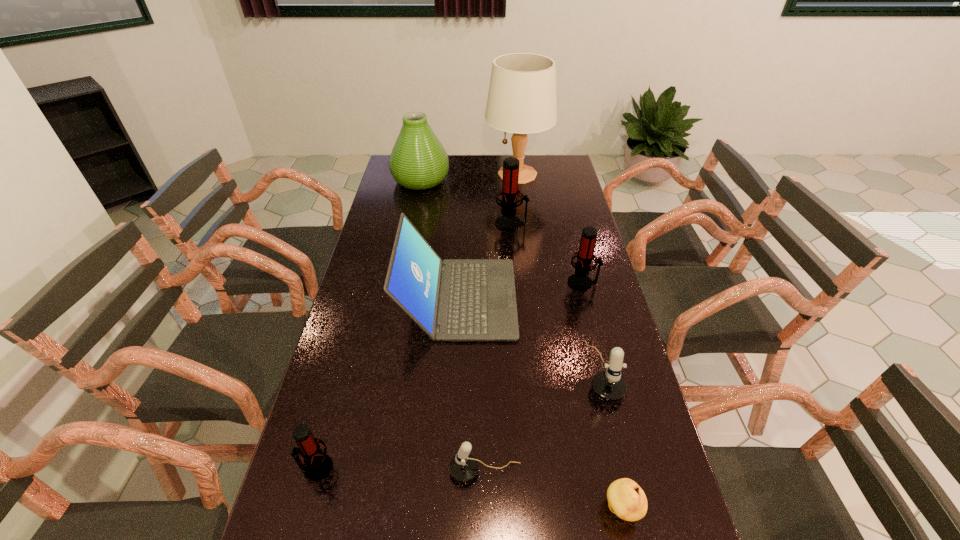
Locate an element on the screen. This screenshot has height=540, width=960. the nearest red microphone is located at coordinates (317, 465).

Locate an element on the screen. This screenshot has height=540, width=960. the smallest red microphone is located at coordinates (317, 465).

Locate an element on the screen. the left white microphone is located at coordinates (463, 467).

Identify the location of the nearer white microphone. This screenshot has height=540, width=960. (463, 467).

I want to click on the shortest object, so click(626, 499).

Where is `pear`? This screenshot has height=540, width=960. pear is located at coordinates (626, 499).

The image size is (960, 540). Find the location of `vacant region located on the front of the beige table lamp`. vacant region located on the front of the beige table lamp is located at coordinates (521, 205).

You are a GUI agent. You are given a task and a screenshot of the screen. Output one action in this format:
    pyautogui.click(x=<x>, y=<y>)
    Task: Click on the vacant space located 0.050m on the right of the green vase
    This screenshot has height=540, width=960.
    Given the screenshot: What is the action you would take?
    pyautogui.click(x=461, y=180)

The image size is (960, 540). Find the location of `free space located 0.120m on the left of the second red microphone from right to left`. free space located 0.120m on the left of the second red microphone from right to left is located at coordinates (465, 224).

Find the location of `vacant space located 0.400m on the left of the rightmost red microphone`. vacant space located 0.400m on the left of the rightmost red microphone is located at coordinates (447, 283).